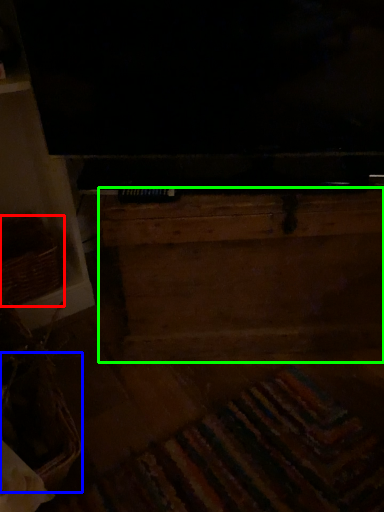
Question: Estimate the real-world distances between objects in this image. Which object is closer to basket (highlighted by a red box), basket (highlighted by a blue box) or dresser (highlighted by a green box)?

Choices:
 (A) basket
 (B) dresser

Answer: (A)